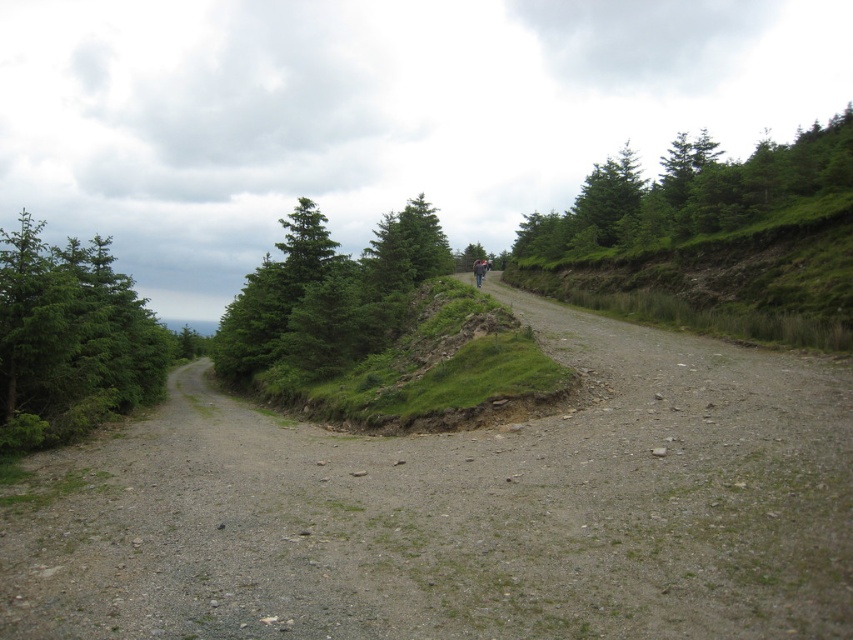
Between dull gray gravel road at left and green leafy trees at center, which one has less height?

dull gray gravel road at left

Between point (619, 337) and point (315, 250), which one is positioned behind?

The point (315, 250) is more distant.

You are a GUI agent. You are given a task and a screenshot of the screen. Output one action in this format:
    pyautogui.click(x=<x>, y=<y>)
    Task: Click on the dull gray gravel road at left
    The width and height of the screenshot is (853, 640).
    Given the screenshot: What is the action you would take?
    pyautogui.click(x=465, y=509)

Who is lower down, green leafy trees at upper right or dark blue fabric mountain biker at center?

Positioned lower is dark blue fabric mountain biker at center.

Between green leafy trees at upper right and dark blue fabric mountain biker at center, which one appears on the right side from the viewer's perspective?

Positioned to the right is green leafy trees at upper right.

Where is `green leafy trees at upper right`? Image resolution: width=853 pixels, height=640 pixels. green leafy trees at upper right is located at coordinates click(692, 193).

Identify the location of green leafy trees at upper right. This screenshot has height=640, width=853. (692, 193).

Can you confirm if dull gray gravel road at left is positioned to the right of green leafy trees at upper right?

No, dull gray gravel road at left is not to the right of green leafy trees at upper right.

This screenshot has width=853, height=640. I want to click on dull gray gravel road at left, so click(465, 509).